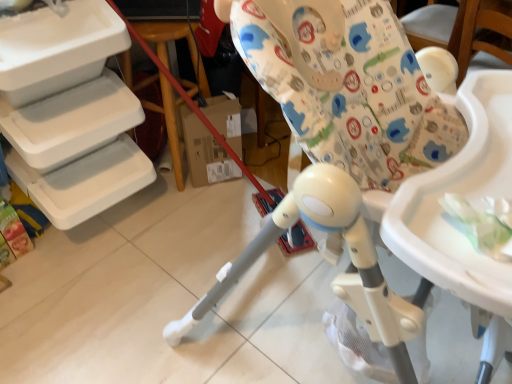
What are the coordinates of `free location to the left of white plastic highchair at center` in the screenshot? It's located at (117, 304).